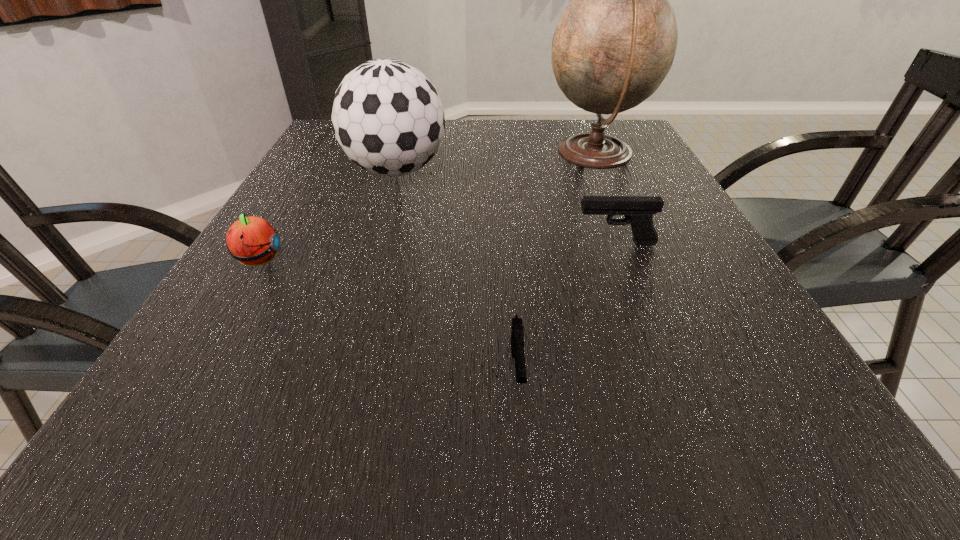
Locate an element on the screen. vacant space at the near left corner is located at coordinates (238, 447).

The image size is (960, 540). What are the coordinates of `free region at the far right corner of the desktop` in the screenshot? It's located at (619, 124).

This screenshot has height=540, width=960. Find the location of `vacant position at the near right corner of the desktop`. vacant position at the near right corner of the desktop is located at coordinates point(761,438).

This screenshot has height=540, width=960. I want to click on empty space between the nearest object and the taller pistol, so click(x=566, y=306).

The image size is (960, 540). Identify the location of vacant area between the second tallest object and the leftmost object. (327, 216).

Identify the location of vacant point located between the third object from right to left and the second tallest object. The height and width of the screenshot is (540, 960). (457, 271).

Find the location of `vacant area that lies between the tallest object and the second object from left to right`. vacant area that lies between the tallest object and the second object from left to right is located at coordinates (495, 163).

In order to click on vacant space in between the fourth object from right to left and the left pistol in this screenshot , I will do `click(457, 271)`.

I want to click on free point between the farther pistol and the leftmost object, so click(x=437, y=252).

Where is `free space between the right pistol and the leftmost object`? This screenshot has height=540, width=960. free space between the right pistol and the leftmost object is located at coordinates (437, 252).